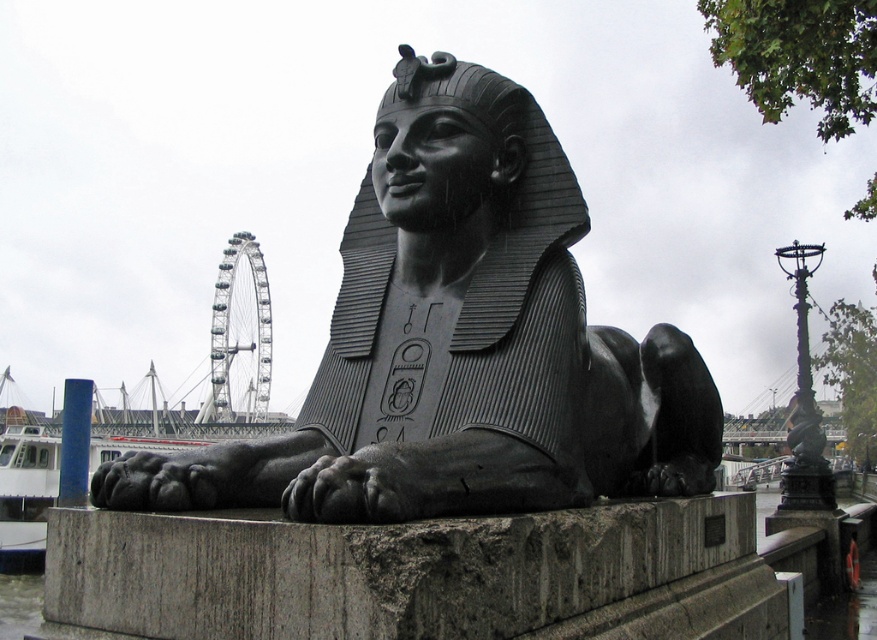
You are standing in front of the black polished stone sphinx at center and the gray stone pedestal at lower center. Which object is positioned to the left?

The black polished stone sphinx at center is positioned to the left of the gray stone pedestal at lower center.

You are standing at the center of the image and want to locate the black polished stone sphinx at center. According to the coordinates provided, in which direction should you look to find it?

The black polished stone sphinx at center is located at coordinates point (460,342), which is slightly to the right and just below the exact center of the image.